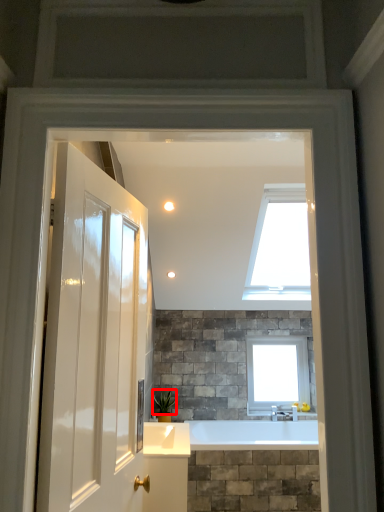
Question: From the image's perspective, where is plant (annotated by the red box) located in relation to window in the image?

Choices:
 (A) below
 (B) above

Answer: (A)